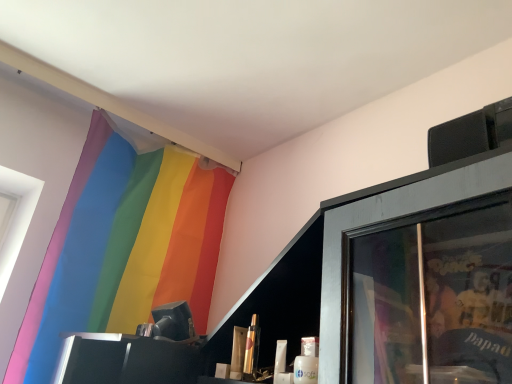
Question: Is rainbow fabric curtain at upper left far away from metallic gold lipstick at center, the 1th toiletry in the left-to-right sequence?

Choices:
 (A) no
 (B) yes

Answer: (A)

Question: Is metallic gold lipstick at center, positioned as the second toiletry in right-to-left order, completely or partially inside rainbow fabric curtain at upper left?

Choices:
 (A) yes
 (B) no

Answer: (B)

Question: Considering the relative sizes of rainbow fabric curtain at upper left and metallic gold lipstick at center, positioned as the second toiletry in right-to-left order, in the image provided, is rainbow fabric curtain at upper left wider than metallic gold lipstick at center, positioned as the second toiletry in right-to-left order,?

Choices:
 (A) no
 (B) yes

Answer: (B)

Question: Is rainbow fabric curtain at upper left taller than metallic gold lipstick at center, the 1th toiletry in the left-to-right sequence?

Choices:
 (A) yes
 (B) no

Answer: (A)

Question: Is the depth of rainbow fabric curtain at upper left less than that of metallic gold lipstick at center, the 1th toiletry in the left-to-right sequence?

Choices:
 (A) yes
 (B) no

Answer: (B)

Question: Does rainbow fabric curtain at upper left lie behind metallic gold lipstick at center, positioned as the second toiletry in right-to-left order?

Choices:
 (A) no
 (B) yes

Answer: (B)

Question: Considering the relative positions of metallic gold lipstick at center, the 2th toiletry in the left-to-right sequence, and metallic gold lipstick at center, the 1th toiletry in the left-to-right sequence, in the image provided, is metallic gold lipstick at center, the 2th toiletry in the left-to-right sequence, to the left of metallic gold lipstick at center, the 1th toiletry in the left-to-right sequence, from the viewer's perspective?

Choices:
 (A) yes
 (B) no

Answer: (B)

Question: From the image's perspective, is metallic gold lipstick at center, the 2th toiletry in the left-to-right sequence, below metallic gold lipstick at center, positioned as the second toiletry in right-to-left order?

Choices:
 (A) no
 (B) yes

Answer: (A)

Question: Is metallic gold lipstick at center, the 2th toiletry in the left-to-right sequence, aimed at metallic gold lipstick at center, the 1th toiletry in the left-to-right sequence?

Choices:
 (A) yes
 (B) no

Answer: (B)

Question: From a real-world perspective, is metallic gold lipstick at center, the 2th toiletry in the left-to-right sequence, on top of metallic gold lipstick at center, positioned as the second toiletry in right-to-left order?

Choices:
 (A) no
 (B) yes

Answer: (B)

Question: Considering the relative sizes of metallic gold lipstick at center, marked as the 1th toiletry in a right-to-left arrangement, and metallic gold lipstick at center, positioned as the second toiletry in right-to-left order, in the image provided, is metallic gold lipstick at center, marked as the 1th toiletry in a right-to-left arrangement, smaller than metallic gold lipstick at center, positioned as the second toiletry in right-to-left order,?

Choices:
 (A) yes
 (B) no

Answer: (A)

Question: Considering the relative sizes of metallic gold lipstick at center, marked as the 1th toiletry in a right-to-left arrangement, and metallic gold lipstick at center, positioned as the second toiletry in right-to-left order, in the image provided, is metallic gold lipstick at center, marked as the 1th toiletry in a right-to-left arrangement, wider than metallic gold lipstick at center, positioned as the second toiletry in right-to-left order,?

Choices:
 (A) yes
 (B) no

Answer: (B)

Question: Is rainbow fabric curtain at upper left positioned before metallic gold lipstick at center, marked as the 1th toiletry in a right-to-left arrangement?

Choices:
 (A) yes
 (B) no

Answer: (B)